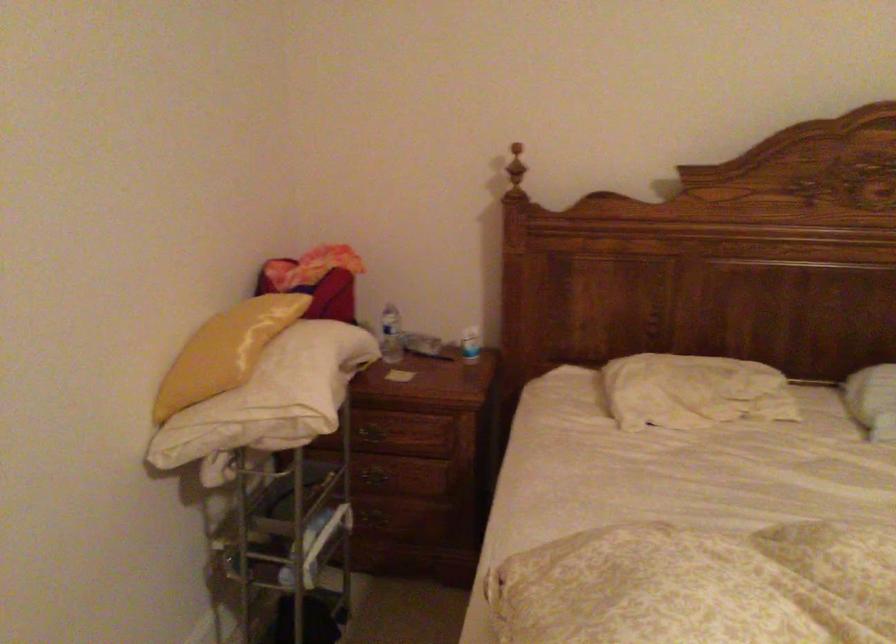
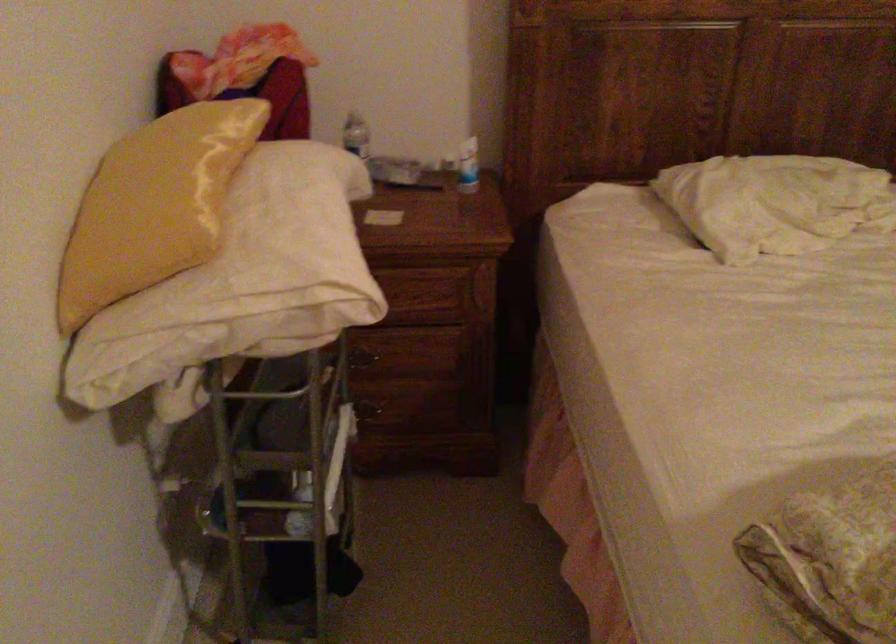
Where in the second image is the point corresponding to pixel 216 353 from the first image?

(153, 205)